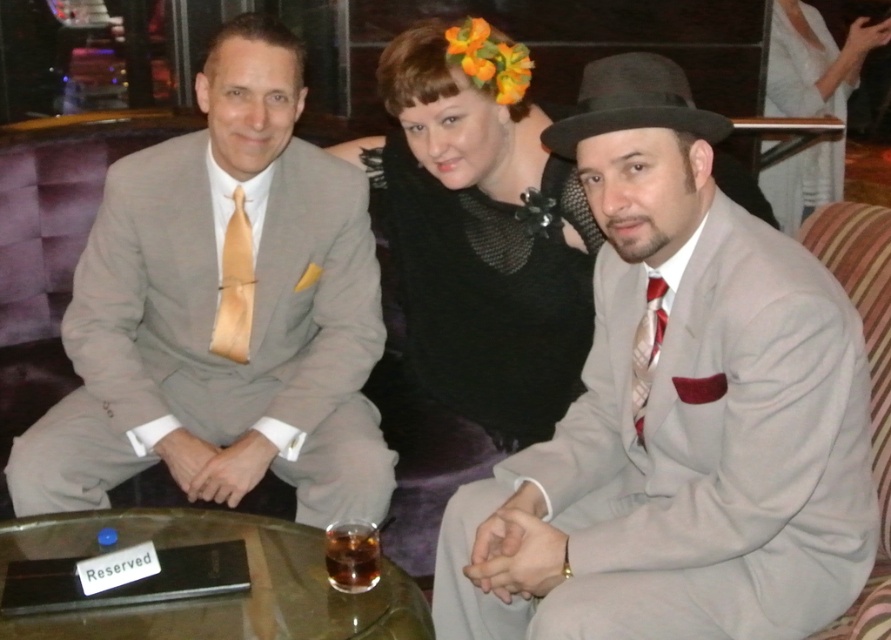
Is point (835, 108) closer to camera compared to point (345, 563)?

No, it is not.

Is white satin dress at upper right bigger than translucent glass at center?

Yes, white satin dress at upper right is bigger than translucent glass at center.

This screenshot has height=640, width=891. I want to click on white satin dress at upper right, so click(x=805, y=65).

Is matte gray suit at left smaller than satin gold tie at left?

No.

You are a GUI agent. You are given a task and a screenshot of the screen. Output one action in this format:
    pyautogui.click(x=<x>, y=<y>)
    Task: Click on the matte gray suit at left
    
    Given the screenshot: What is the action you would take?
    (215, 314)

The width and height of the screenshot is (891, 640). What are the coordinates of `matte gray suit at left` in the screenshot? It's located at (215, 314).

Can you confirm if matte gray suit at left is positioned above white striped tie at right?

Yes.

Is the position of matte gray suit at left less distant than that of white striped tie at right?

No, matte gray suit at left is further to the viewer.

This screenshot has height=640, width=891. What are the coordinates of `matte gray suit at left` in the screenshot? It's located at 215,314.